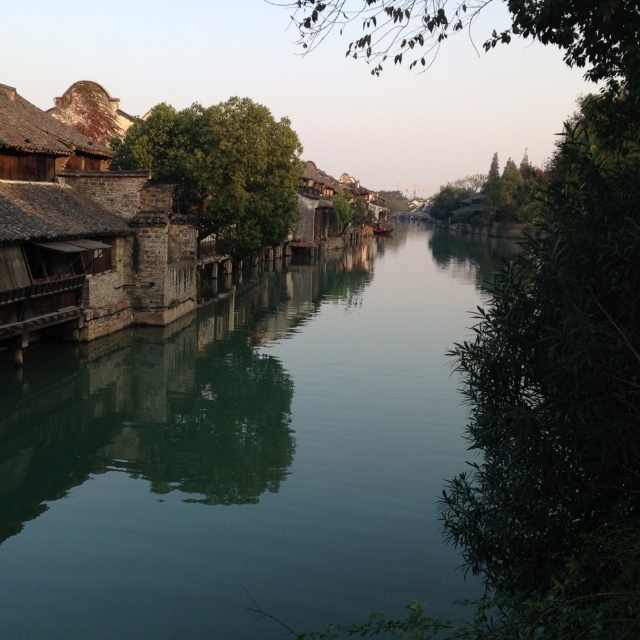
You are a drone operator planning to fly a drone from the green leafy tree at center right to the green leafy tree at upper right. The drone has a maximum flight range of 50 meters. Based on the scene, can the drone successfully make the trip without needing to recharge?

The distance between the green leafy tree at center right and the green leafy tree at upper right is 46.86 meters, which is within the drone operator drone has a maximum flight range of 50 meters. The drone can successfully make the trip without needing to recharge.

You are a tour guide leading a group along the canal. You want to point out both the rusty metal roof at upper left and the green leafy tree at upper right to your group. If your voice can carry up to 140 meters, can your group hear you clearly when you mention both landmarks from where you are standing?

The rusty metal roof at upper left and the green leafy tree at upper right are 138.54 meters apart from each other. Since your voice can carry up to 140 meters, your group can hear you clearly when you mention both landmarks from where you are standing.